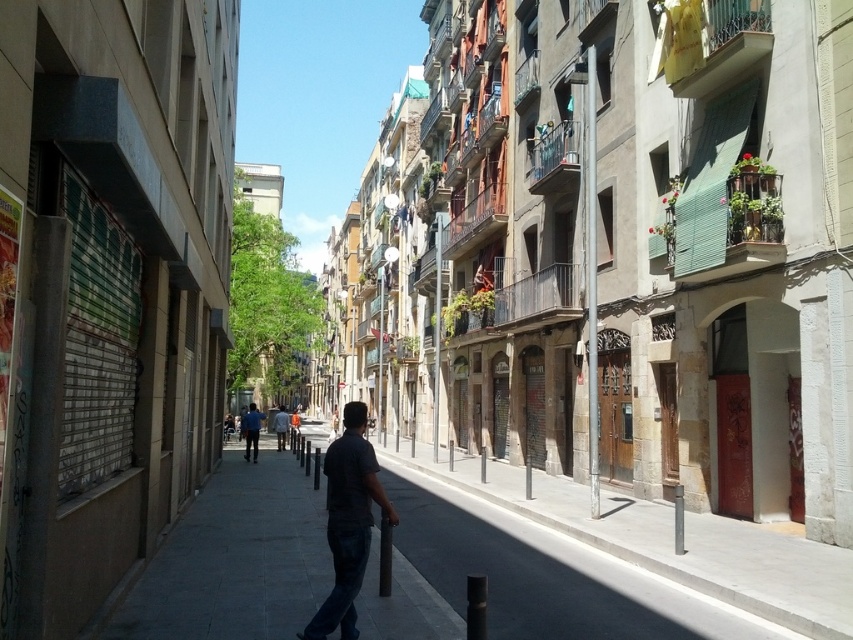
You are a delivery person carrying a large package and need to walk along the smooth concrete sidewalk at center while avoiding stepping on the dark gray shirt at center. Can you fit both the sidewalk and the shirt in your path without overlapping?

The smooth concrete sidewalk at center is larger in size than the dark gray shirt at center, so yes, the delivery person can fit both in their path since the sidewalk is bigger and can accommodate the shirt without overlapping.

You are standing on the smooth concrete sidewalk at center and want to move to the dark gray shirt at center. Which direction should you move to reach it?

The smooth concrete sidewalk at center is to the right of the dark gray shirt at center, so you should move to the left to reach it.